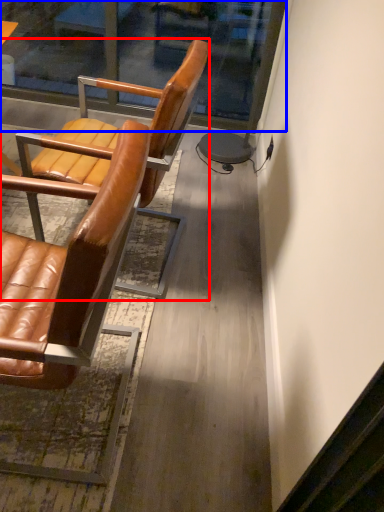
Question: Which object appears closest to the camera in this image, chair (highlighted by a red box) or glass door (highlighted by a blue box)?

Choices:
 (A) chair
 (B) glass door

Answer: (A)